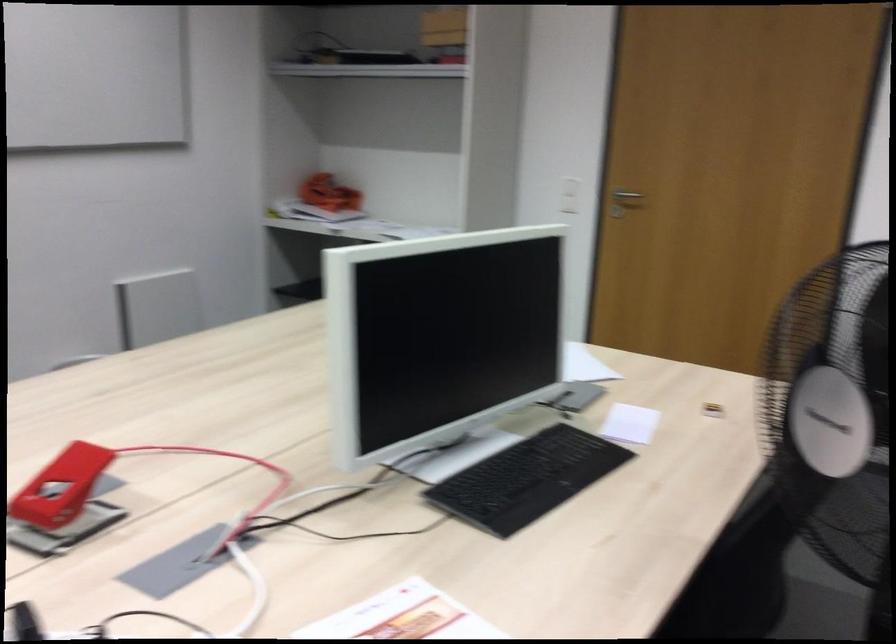
I want to click on white fan knob, so click(x=831, y=408).